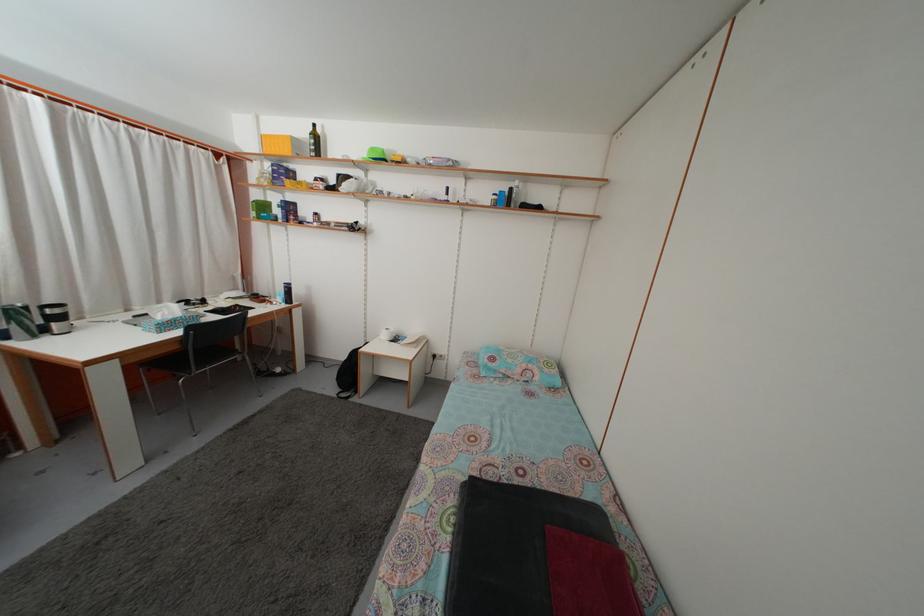
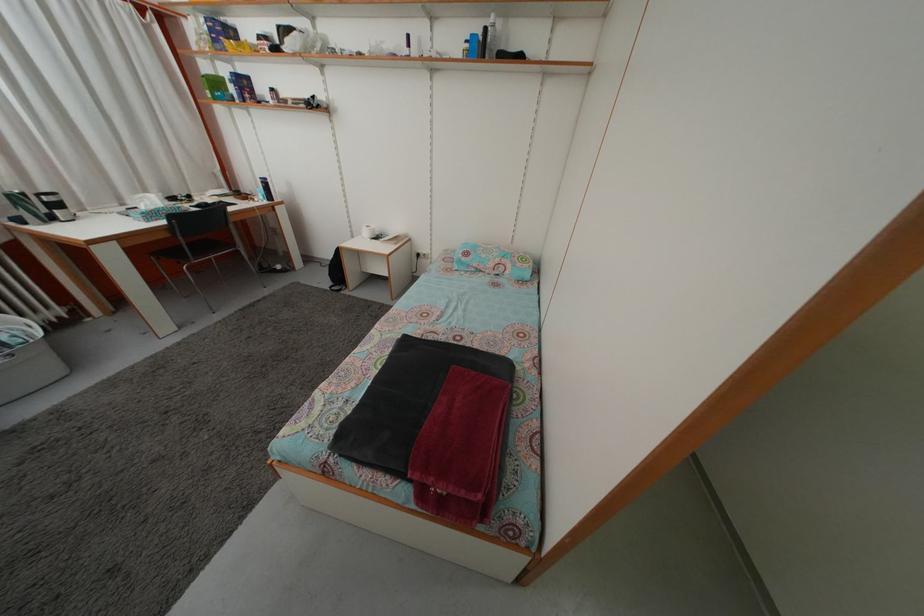
Find the pixel in the second image that matches point (501, 204) in the first image.

(473, 53)